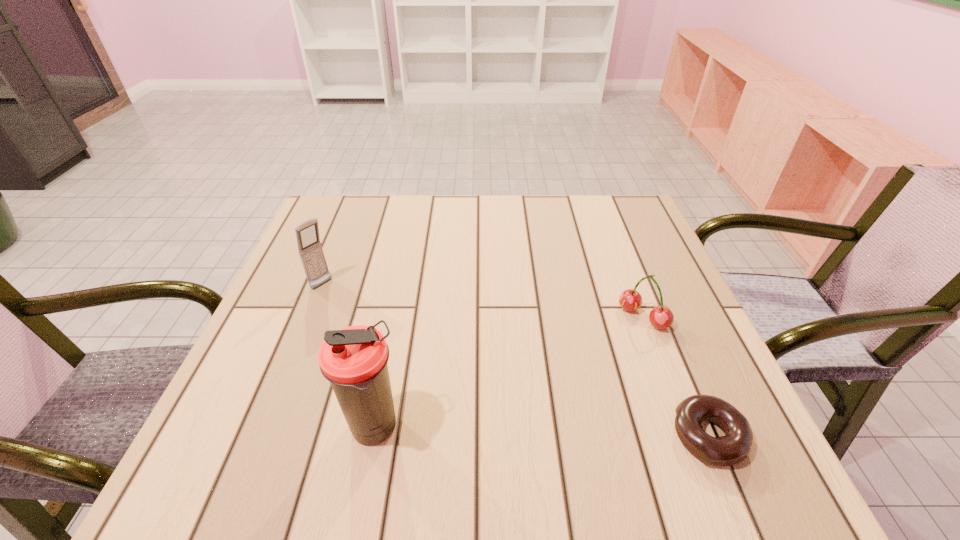
The height and width of the screenshot is (540, 960). What are the coordinates of `object present at the near right corner` in the screenshot? It's located at click(735, 446).

Image resolution: width=960 pixels, height=540 pixels. I want to click on vacant space at the far edge of the desktop, so click(x=430, y=213).

Find the location of `vacant space at the near edge of the desktop`. vacant space at the near edge of the desktop is located at coordinates (477, 414).

In order to click on free region at the left edge in this screenshot , I will do `click(348, 287)`.

At what (x,y) coordinates should I click in order to perform the action: click on vacant space at the right edge of the desktop. Please return your answer as a coordinate pair (x, y). The image size is (960, 540). Looking at the image, I should click on coord(675,348).

At what (x,y) coordinates should I click in order to perform the action: click on vacant space at the far left corner of the desktop. Please return your answer as a coordinate pair (x, y). The image size is (960, 540). Looking at the image, I should click on (327, 240).

Where is `vacant space at the near left corner of the desktop`? The image size is (960, 540). vacant space at the near left corner of the desktop is located at coordinates (257, 391).

Image resolution: width=960 pixels, height=540 pixels. I want to click on free area in between the third object from right to left and the doughnut, so click(x=541, y=431).

Where is `free space between the doughnut and the second tallest object`? This screenshot has height=540, width=960. free space between the doughnut and the second tallest object is located at coordinates (516, 360).

This screenshot has height=540, width=960. Identify the location of vacant region between the shortest object and the second shortest object. (675, 376).